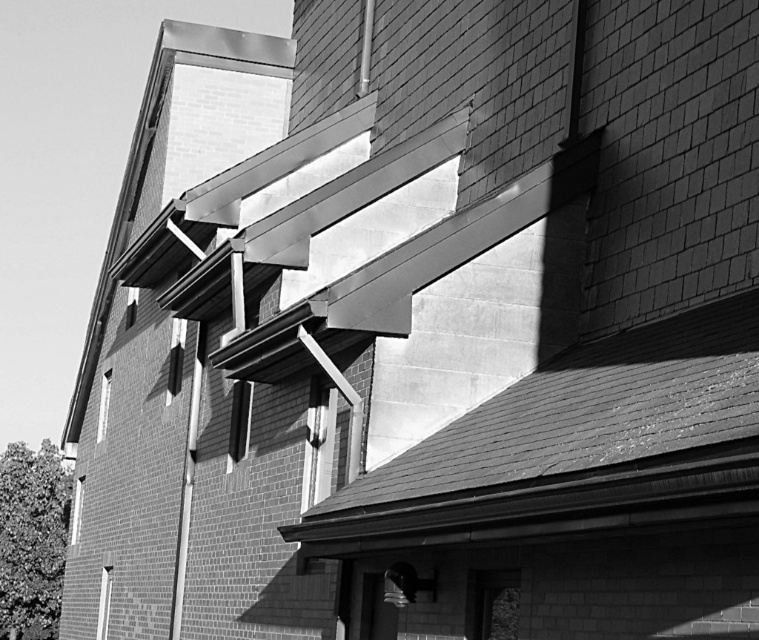
You are standing in front of the building and notice two windows. One is the matte glass window at center and the other is the transparent glass window at lower left. Which window is positioned to the right side of the other?

The matte glass window at center is positioned to the right of the transparent glass window at lower left.